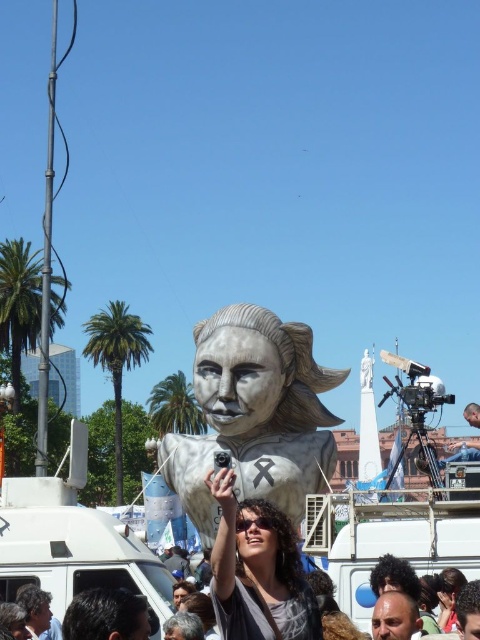
In the scene shown: You are a photographer standing in front of the white glossy statue at center and the matte silver statue at center. You want to take a photo that includes both statues. Which statue should be closer to you to ensure both are in frame?

The white glossy statue at center should be closer to you because the matte silver statue at center is behind it, so positioning yourself closer to the white glossy statue at center will allow both to be in the frame without one blocking the other.